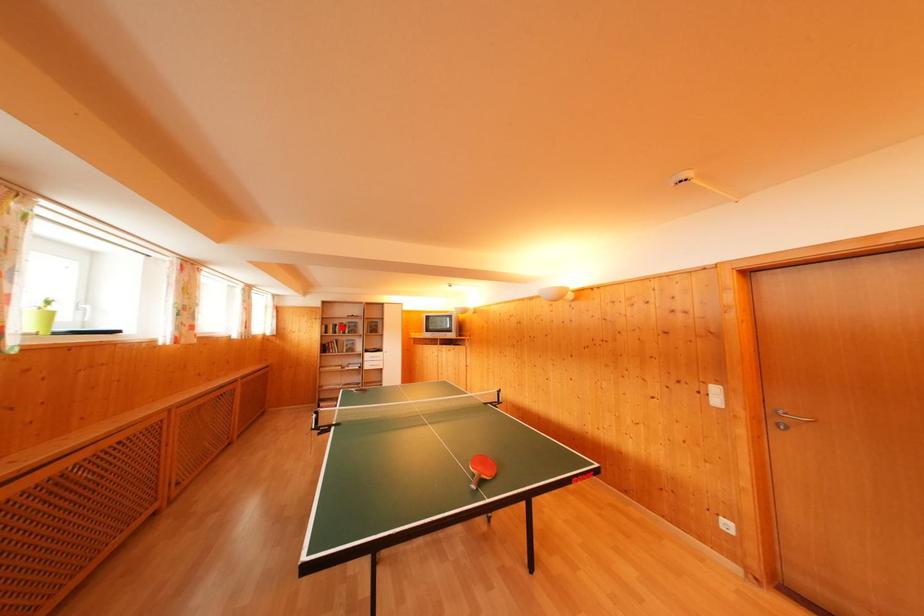
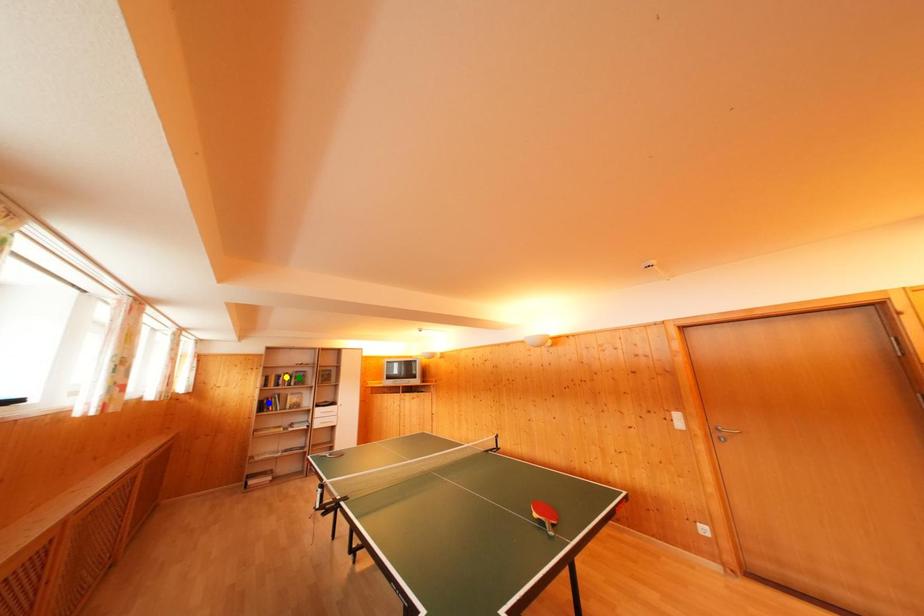
Question: I am providing you with two images of the same scene from different viewpoints. A red point is marked on the first image. You are given multiple points on the second image. Which point in image 2 is actually the same real-world point as the red point in image 1?

Choices:
 (A) green point
 (B) blue point
 (C) yellow point

Answer: (C)